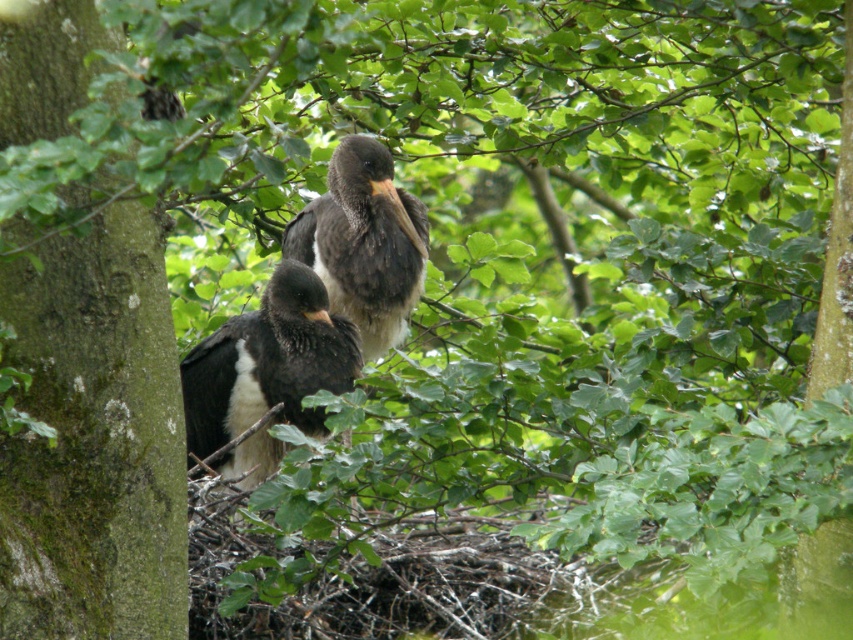
Question: Which object is closer to the camera taking this photo?

Choices:
 (A) dark gray feathers at center
 (B) dark brown feathers at center

Answer: (B)

Question: Which object is farther from the camera taking this photo?

Choices:
 (A) dark gray feathers at center
 (B) dark brown feathers at center

Answer: (A)

Question: Does dark brown feathers at center appear over dark gray feathers at center?

Choices:
 (A) no
 (B) yes

Answer: (A)

Question: Does dark brown feathers at center have a smaller size compared to dark gray feathers at center?

Choices:
 (A) yes
 (B) no

Answer: (A)

Question: Is dark brown feathers at center to the left of dark gray feathers at center from the viewer's perspective?

Choices:
 (A) yes
 (B) no

Answer: (A)